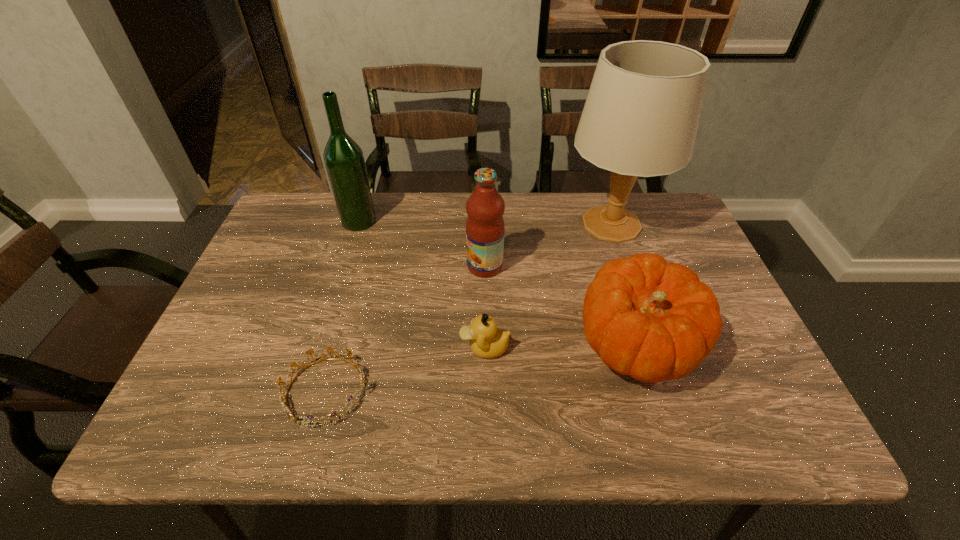
Find the location of `the tallest object`. the tallest object is located at coordinates (641, 115).

Locate an element on the screen. the second tallest object is located at coordinates (344, 160).

Locate an element on the screen. The width and height of the screenshot is (960, 540). the third tallest object is located at coordinates (485, 227).

The image size is (960, 540). I want to click on the fourth tallest object, so coord(652,320).

You are a GUI agent. You are given a task and a screenshot of the screen. Output one action in this format:
    pyautogui.click(x=<x>, y=<y>)
    Task: Click on the duckling
    
    Given the screenshot: What is the action you would take?
    pyautogui.click(x=487, y=341)

Find the location of a particular element. The height and width of the screenshot is (540, 960). tiara is located at coordinates (284, 403).

Where is `vacant space located 0.200m on the front of the tallest object`? This screenshot has height=540, width=960. vacant space located 0.200m on the front of the tallest object is located at coordinates (641, 313).

The width and height of the screenshot is (960, 540). Find the location of `vacant space located 0.270m on the right of the alcohol`. vacant space located 0.270m on the right of the alcohol is located at coordinates (466, 221).

The width and height of the screenshot is (960, 540). Identify the location of free space located 0.240m on the front label of the third tallest object. (378, 266).

Locate an element on the screen. The height and width of the screenshot is (540, 960). vacant area situated 0.060m on the front label of the third tallest object is located at coordinates (444, 266).